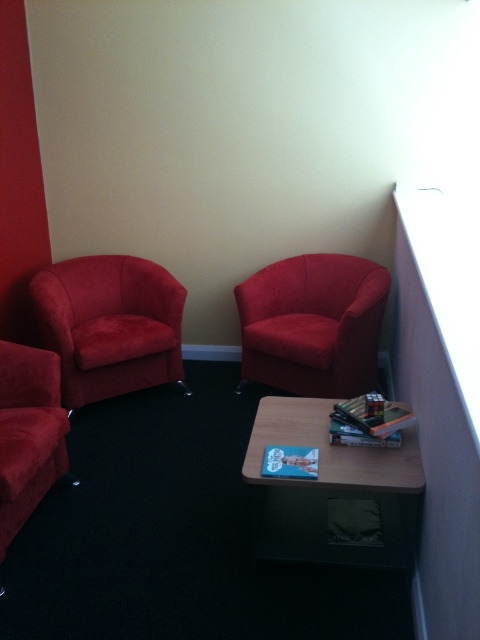
Question: Which point is farther to the camera?

Choices:
 (A) velvet red armchair at upper right
 (B) matte red couch at left

Answer: (A)

Question: Is wooden side table at lower center bigger than matte red couch at left?

Choices:
 (A) no
 (B) yes

Answer: (B)

Question: In this image, where is wooden side table at lower center located relative to matte red couch at left?

Choices:
 (A) left
 (B) right

Answer: (B)

Question: Is velvet red armchair at upper right to the right of matte red couch at left from the viewer's perspective?

Choices:
 (A) yes
 (B) no

Answer: (A)

Question: Based on their relative distances, which object is farther from the wooden side table at lower center?

Choices:
 (A) velvet red armchair at upper right
 (B) matte red couch at left

Answer: (B)

Question: Estimate the real-world distances between objects in this image. Which object is closer to the velvet red armchair at upper right?

Choices:
 (A) matte red couch at left
 (B) wooden side table at lower center
 (C) velvet red armchair at left

Answer: (C)